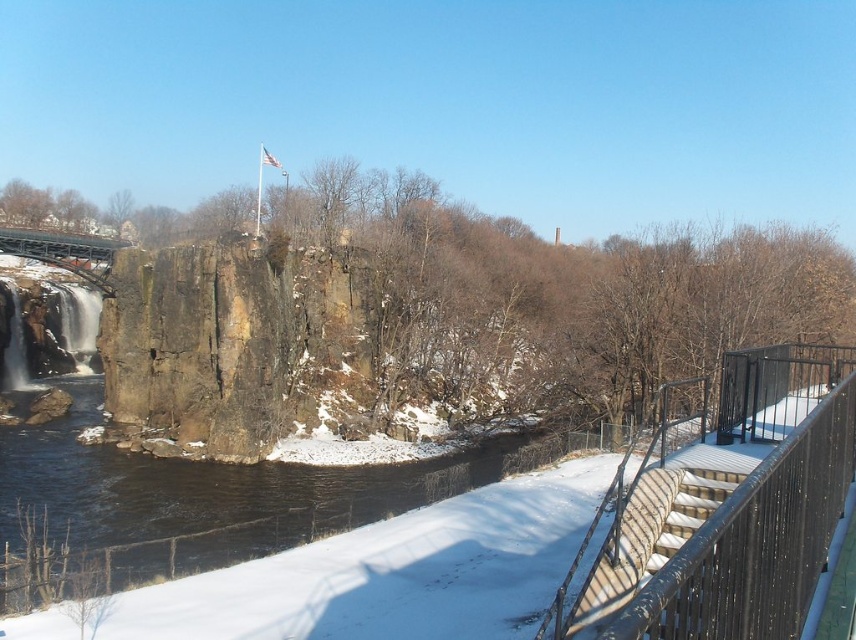
Question: Is black metal railing at right closer to the viewer compared to metallic gray bridge at upper left?

Choices:
 (A) yes
 (B) no

Answer: (A)

Question: Considering the relative positions of black metal railing at right and metallic gray bridge at upper left in the image provided, where is black metal railing at right located with respect to metallic gray bridge at upper left?

Choices:
 (A) left
 (B) right

Answer: (B)

Question: Which object appears farthest from the camera in this image?

Choices:
 (A) metallic gray bridge at upper left
 (B) black metal railing at right

Answer: (A)

Question: Which object is closer to the camera taking this photo?

Choices:
 (A) metallic gray bridge at upper left
 (B) black metal railing at right

Answer: (B)

Question: In this image, where is black metal railing at right located relative to metallic gray bridge at upper left?

Choices:
 (A) above
 (B) below

Answer: (B)